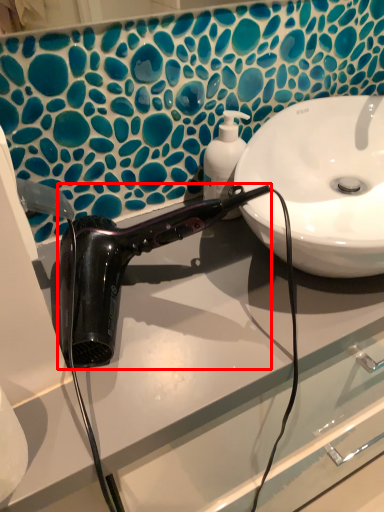
Question: From the image's perspective, considering the relative positions of hair dryer (annotated by the red box) and soap dispenser in the image provided, where is hair dryer (annotated by the red box) located with respect to the staircase?

Choices:
 (A) below
 (B) above

Answer: (A)